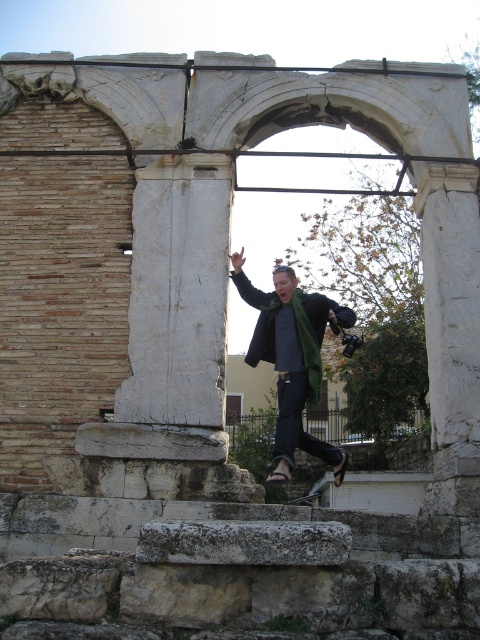
Question: Is white stone column at center thinner than green wool scarf at center?

Choices:
 (A) no
 (B) yes

Answer: (B)

Question: Among these points, which one is farthest from the camera?

Choices:
 (A) [310, 317]
 (B) [133, 292]

Answer: (A)

Question: Which point is farther from the camera taking this photo?

Choices:
 (A) (195, 184)
 (B) (282, 376)

Answer: (B)

Question: Can you confirm if white stone column at center is positioned above green wool scarf at center?

Choices:
 (A) yes
 (B) no

Answer: (A)

Question: In this image, where is white stone column at center located relative to green wool scarf at center?

Choices:
 (A) left
 (B) right

Answer: (A)

Question: Among these points, which one is farthest from the camera?

Choices:
 (A) (274, 481)
 (B) (144, 401)

Answer: (A)